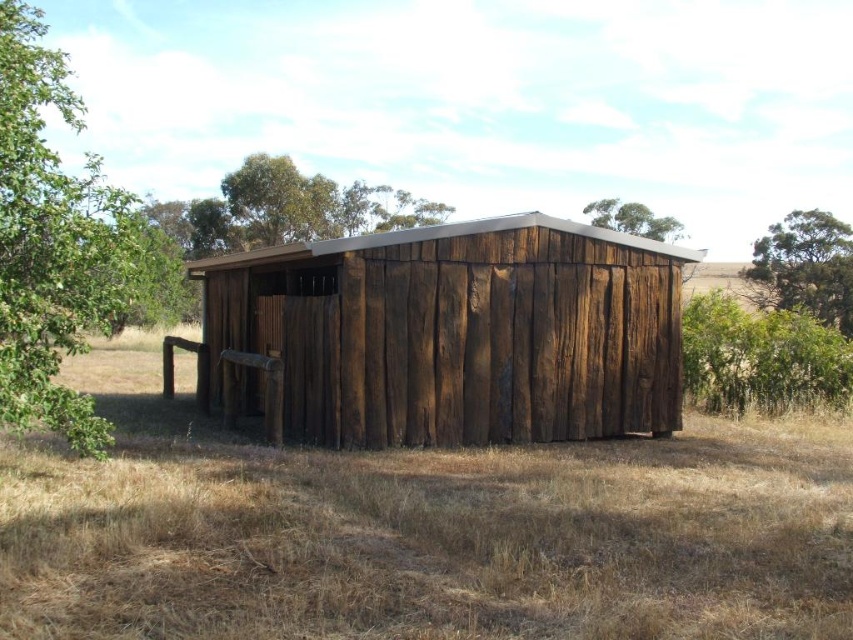
Is point (280, 561) positioned before point (659, 216)?

Yes.

Which of these two, brown dry grass at center or green leafy tree at upper center, stands taller?

Standing taller between the two is green leafy tree at upper center.

Which is in front, point (618, 595) or point (666, 230)?

Point (618, 595) is more forward.

Identify the location of brown dry grass at center. (418, 531).

Who is lower down, brown dry grass at center or green leafy tree at left?

brown dry grass at center

Does brown dry grass at center have a lesser width compared to green leafy tree at left?

Correct, brown dry grass at center's width is less than green leafy tree at left's.

Between point (801, 636) and point (26, 177), which one is positioned in front?

Point (801, 636) is more forward.

Where is `brown dry grass at center`? Image resolution: width=853 pixels, height=640 pixels. brown dry grass at center is located at coordinates (418, 531).

Where is `brown dry grass at center`? brown dry grass at center is located at coordinates (418, 531).

Between point (688, 416) and point (786, 284), which one is positioned in front?

Point (688, 416) is in front.

Does point (119, 595) lie behind point (747, 276)?

No.

I want to click on brown dry grass at center, so click(x=418, y=531).